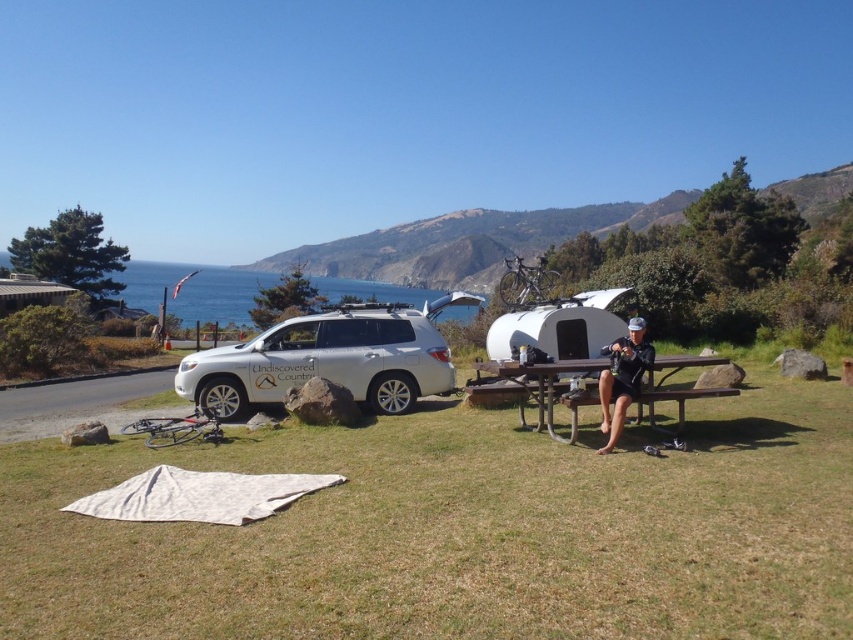
Question: Can you confirm if white metallic suv at center is positioned to the right of black matte shorts at center?

Choices:
 (A) yes
 (B) no

Answer: (B)

Question: Considering the relative positions of green grass at lower center and metallic silver trailer at center in the image provided, where is green grass at lower center located with respect to metallic silver trailer at center?

Choices:
 (A) right
 (B) left

Answer: (B)

Question: Which object appears closest to the camera in this image?

Choices:
 (A) metallic silver trailer at center
 (B) black matte shorts at center
 (C) green grass at lower center
 (D) white metallic suv at center

Answer: (C)

Question: Estimate the real-world distances between objects in this image. Which object is farther from the metallic silver trailer at center?

Choices:
 (A) blue water at upper left
 (B) brown wooden picnic table at center

Answer: (A)

Question: Which point is farther to the camera?

Choices:
 (A) black matte shorts at center
 (B) metallic silver trailer at center

Answer: (B)

Question: Does white metallic suv at center appear over blue water at upper left?

Choices:
 (A) yes
 (B) no

Answer: (B)